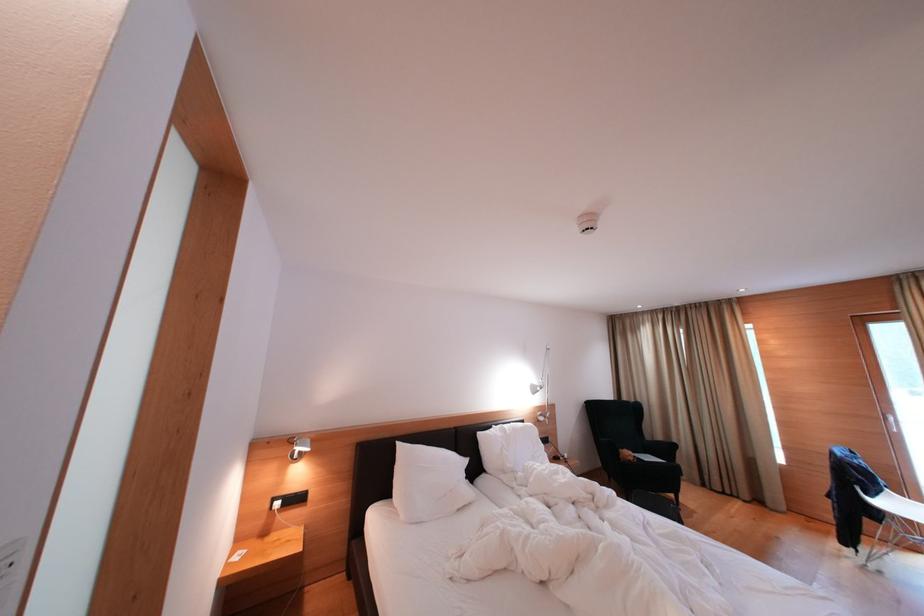
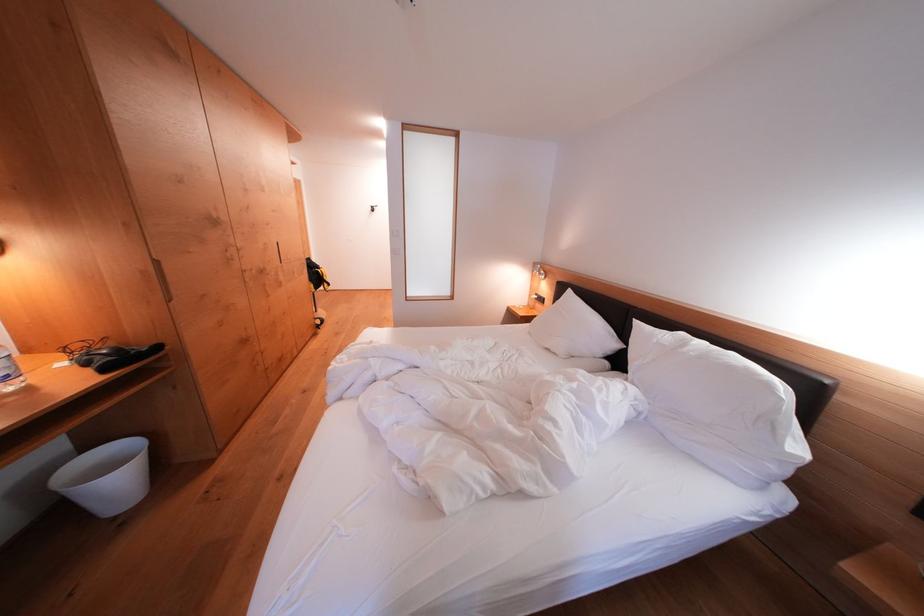
Find the pixel in the second image that matches point 247,544 in the first image.

(536, 310)